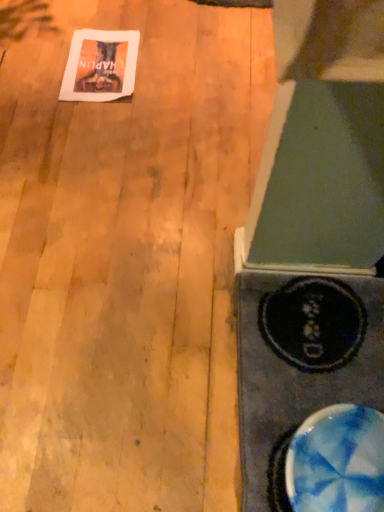
Identify the location of free space above wooden floor at upper left (from a real-world perspective). This screenshot has width=384, height=512. (140, 191).